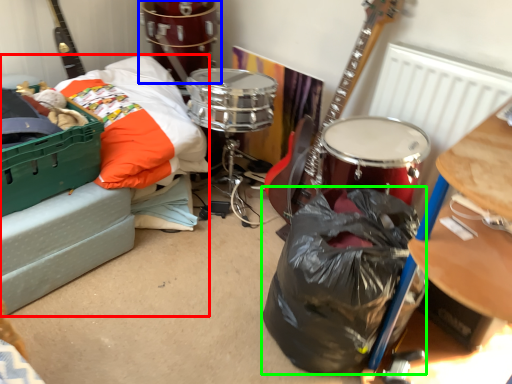
Question: Which is nearer to the couch (highlighted by a red box)? drum (highlighted by a blue box) or garbage (highlighted by a green box).

Choices:
 (A) drum
 (B) garbage

Answer: (A)